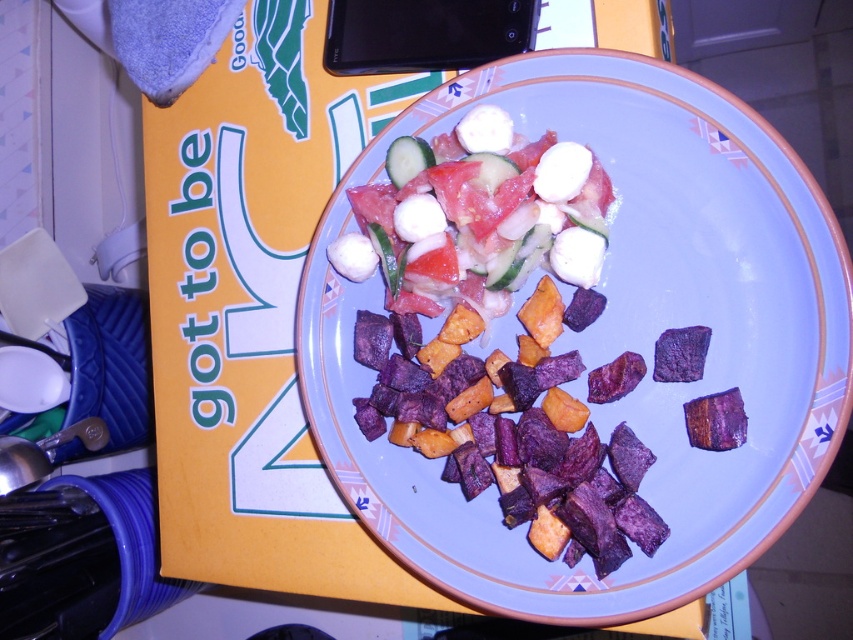
You are a food stylist arranging this plate. You need to adjust the position of the purple matte sweet potato cubes at center and the fresh tomato salad with mozzarella at center so that the salad becomes the focal point. Which object should you move and in what direction?

The purple matte sweet potato cubes at center is currently in front of the fresh tomato salad with mozzarella at center. To make the salad the focal point, you should move the purple matte sweet potato cubes at center backward so that the fresh tomato salad with mozzarella at center becomes visible and centered.

You are looking at the plate of food. There are two points marked on the image. The first point is at coordinates point (741, 150) and the second point is at point (503, 113). From your perspective, which point is closer to you?

Point (741, 150) is in front of point (503, 113), so the first point is closer to you.